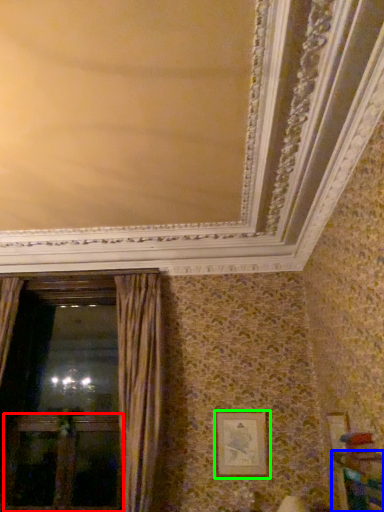
Question: Considering the real-world distances, which object is farthest from screen door (highlighted by a red box)? furniture (highlighted by a blue box) or picture frame (highlighted by a green box)?

Choices:
 (A) furniture
 (B) picture frame

Answer: (A)